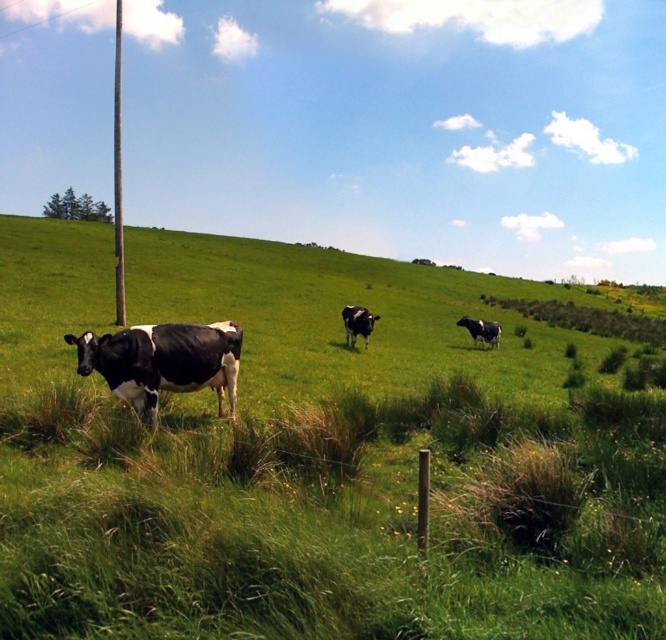
Question: Is black and white cow at left wider than metallic gray pole at left?

Choices:
 (A) no
 (B) yes

Answer: (A)

Question: Which of the following is the farthest from the observer?

Choices:
 (A) (486, 332)
 (B) (141, 397)
 (C) (115, 72)

Answer: (C)

Question: Is green grassy at center above black and white cow at center?

Choices:
 (A) yes
 (B) no

Answer: (A)

Question: Which of the following is the closest to the observer?

Choices:
 (A) black glossy cow at center
 (B) metallic gray pole at left
 (C) black and white cow at left

Answer: (C)

Question: Which point is closer to the camera?

Choices:
 (A) black and white cow at left
 (B) metallic gray pole at left

Answer: (A)

Question: Considering the relative positions of black glossy cow at center and black and white cow at center in the image provided, where is black glossy cow at center located with respect to black and white cow at center?

Choices:
 (A) left
 (B) right

Answer: (A)